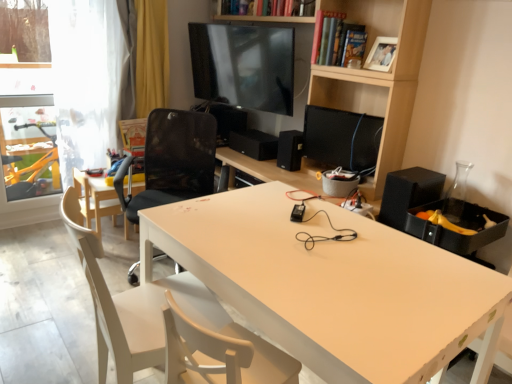
Question: Should I look upward or downward to see black mesh chair at center, which is the second chair in back-to-front order?

Choices:
 (A) down
 (B) up

Answer: (A)

Question: Is white wood chair at lower left, marked as the third chair in a back-to-front arrangement, facing away from black matte speaker at center, which is the 2th speaker in right-to-left order?

Choices:
 (A) no
 (B) yes

Answer: (A)

Question: Can you confirm if white wood chair at lower left, which is the 1th chair from front to back, is smaller than black matte speaker at center, the 2th speaker viewed from the left?

Choices:
 (A) yes
 (B) no

Answer: (B)

Question: Is white wood chair at lower left, which is the 1th chair from front to back, at the right side of black matte speaker at center, which is the 2th speaker in right-to-left order?

Choices:
 (A) yes
 (B) no

Answer: (B)

Question: From a real-world perspective, is white wood chair at lower left, which is the 1th chair from front to back, on top of black matte speaker at center, marked as the second speaker in a front-to-back arrangement?

Choices:
 (A) yes
 (B) no

Answer: (B)

Question: Is white wood chair at lower left, marked as the third chair in a back-to-front arrangement, wider than black matte speaker at center, marked as the second speaker in a back-to-front arrangement?

Choices:
 (A) no
 (B) yes

Answer: (B)

Question: Is white wood chair at lower left, which is the 1th chair from front to back, positioned before black matte speaker at center, the 2th speaker viewed from the left?

Choices:
 (A) no
 (B) yes

Answer: (B)

Question: From the image's perspective, is black matte computer monitor at center on light wood chair at left, which appears as the 3th chair when viewed from the front?

Choices:
 (A) yes
 (B) no

Answer: (A)

Question: Would you say light wood chair at left, which appears as the 3th chair when viewed from the front, is part of black matte computer monitor at center's contents?

Choices:
 (A) no
 (B) yes

Answer: (A)

Question: Could you tell me if black matte computer monitor at center is turned towards light wood chair at left, which appears as the 3th chair when viewed from the front?

Choices:
 (A) no
 (B) yes

Answer: (A)

Question: Considering the relative sizes of black matte computer monitor at center and light wood chair at left, which appears as the 3th chair when viewed from the front, in the image provided, is black matte computer monitor at center bigger than light wood chair at left, which appears as the 3th chair when viewed from the front,?

Choices:
 (A) no
 (B) yes

Answer: (B)

Question: Is black matte computer monitor at center positioned far away from light wood chair at left, which ranks as the 1th chair in back-to-front order?

Choices:
 (A) yes
 (B) no

Answer: (A)

Question: Considering the relative positions of black matte computer monitor at center and light wood chair at left, which appears as the 3th chair when viewed from the front, in the image provided, is black matte computer monitor at center to the left of light wood chair at left, which appears as the 3th chair when viewed from the front, from the viewer's perspective?

Choices:
 (A) yes
 (B) no

Answer: (B)

Question: Does white wood chair at lower left, marked as the third chair in a back-to-front arrangement, lie in front of black mesh chair at center, which is the second chair in back-to-front order?

Choices:
 (A) yes
 (B) no

Answer: (A)